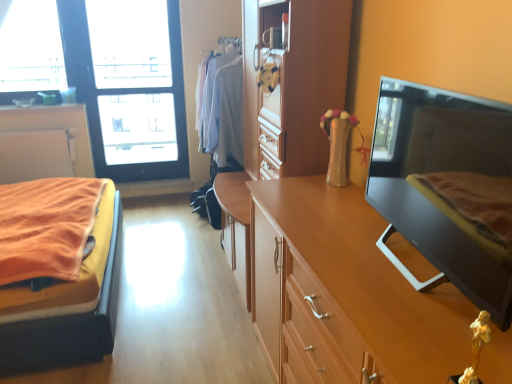
Identify the location of vacant region under black glossy tv at right (from a real-world perspective). (420, 266).